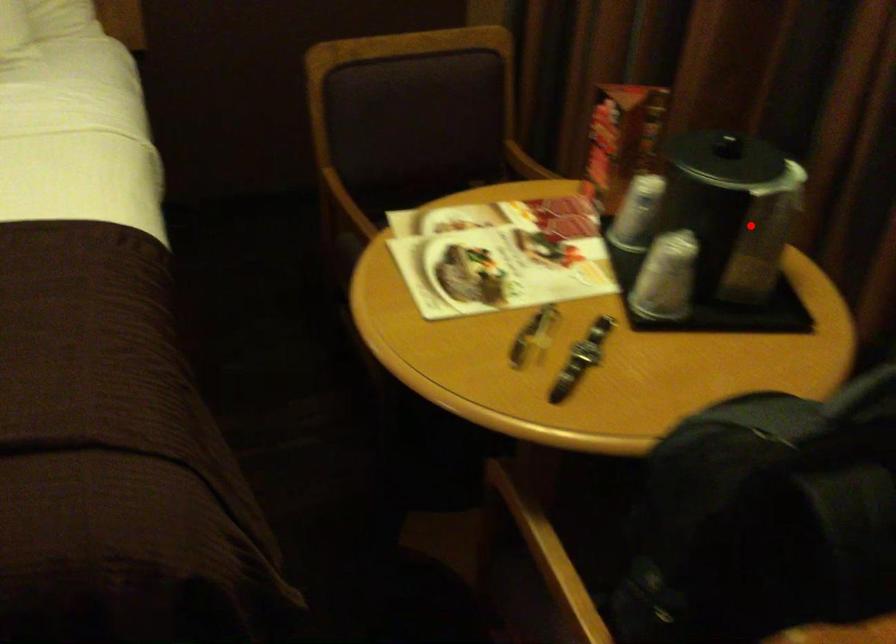
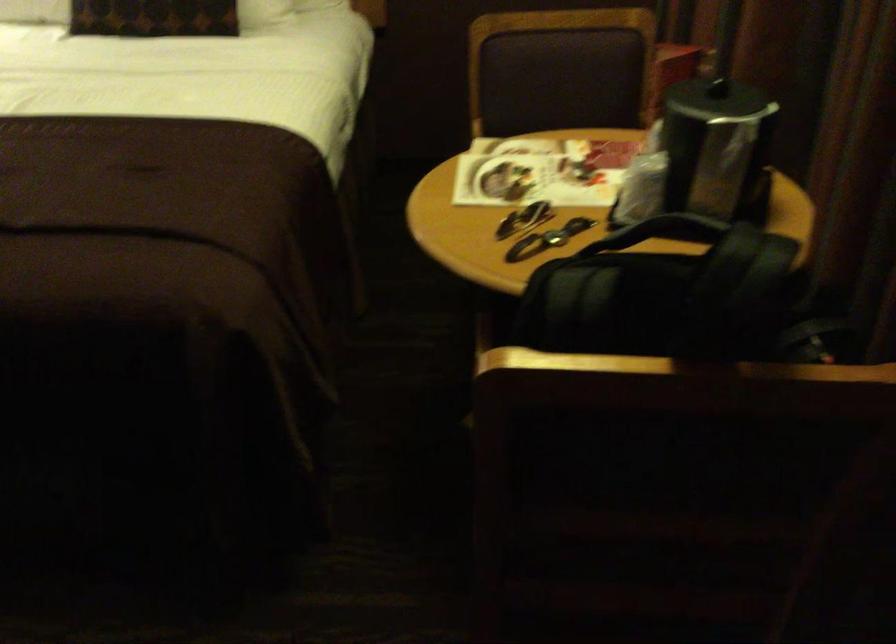
In the second image, find the point that corresponds to the highlighted location in the first image.

(717, 149)